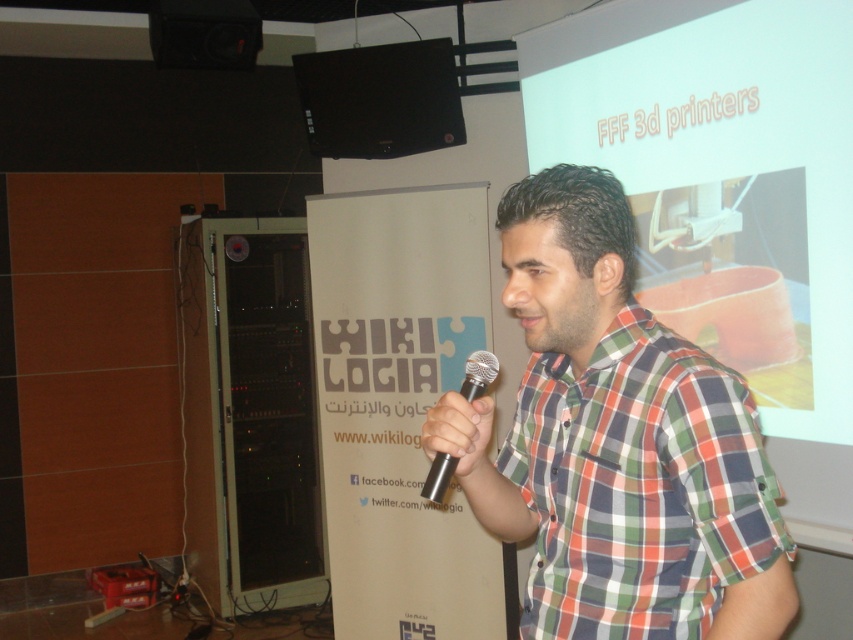
Identify the location of black plastic speaker at upper left. The width and height of the screenshot is (853, 640). (204, 33).

Can you confirm if black plastic speaker at upper left is positioned below metallic silver microphone at center?

Actually, black plastic speaker at upper left is above metallic silver microphone at center.

This screenshot has width=853, height=640. What are the coordinates of `black plastic speaker at upper left` in the screenshot? It's located at (204, 33).

The height and width of the screenshot is (640, 853). What are the coordinates of `black plastic speaker at upper left` in the screenshot? It's located at (204, 33).

Does plaid cotton shirt at center have a smaller size compared to black plastic speaker at upper left?

No.

What do you see at coordinates (616, 442) in the screenshot? I see `plaid cotton shirt at center` at bounding box center [616, 442].

Where is `plaid cotton shirt at center`? plaid cotton shirt at center is located at coordinates (616, 442).

Does point (756, 84) come farther from viewer compared to point (186, 60)?

No, it is not.

Who is more distant from viewer, (804, 115) or (204, 61)?

Positioned behind is point (204, 61).

What are the coordinates of `matte white projector screen at upper center` in the screenshot? It's located at (724, 166).